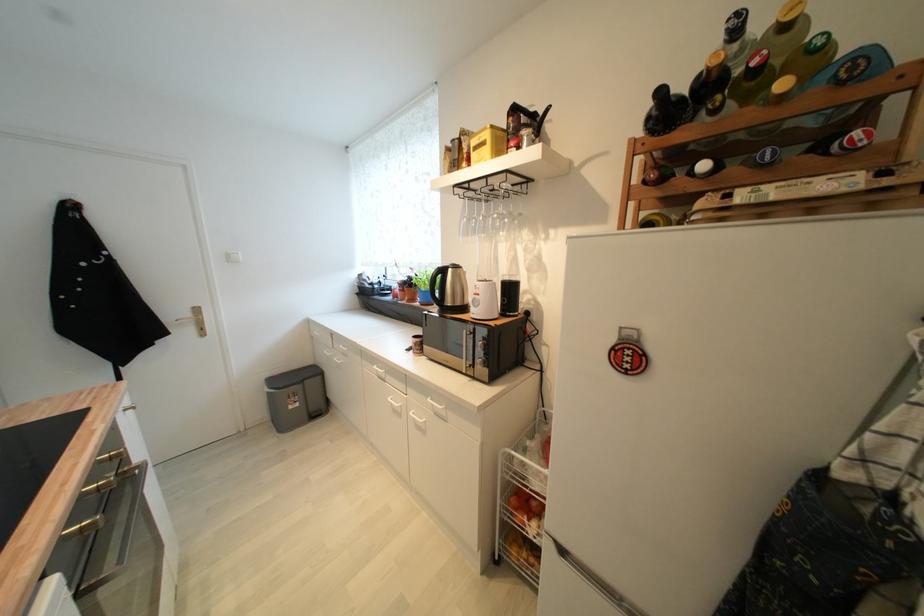
Image resolution: width=924 pixels, height=616 pixels. What do you see at coordinates (627, 352) in the screenshot?
I see `the bottle opener magnet` at bounding box center [627, 352].